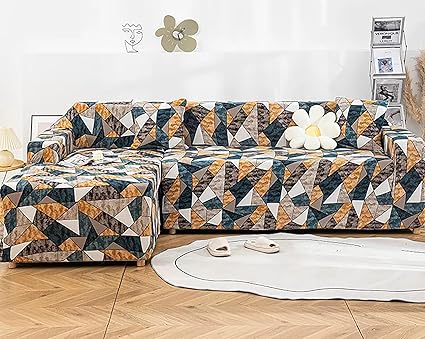
Find the location of a particular element. The image size is (425, 339). table lamp is located at coordinates (6, 157).